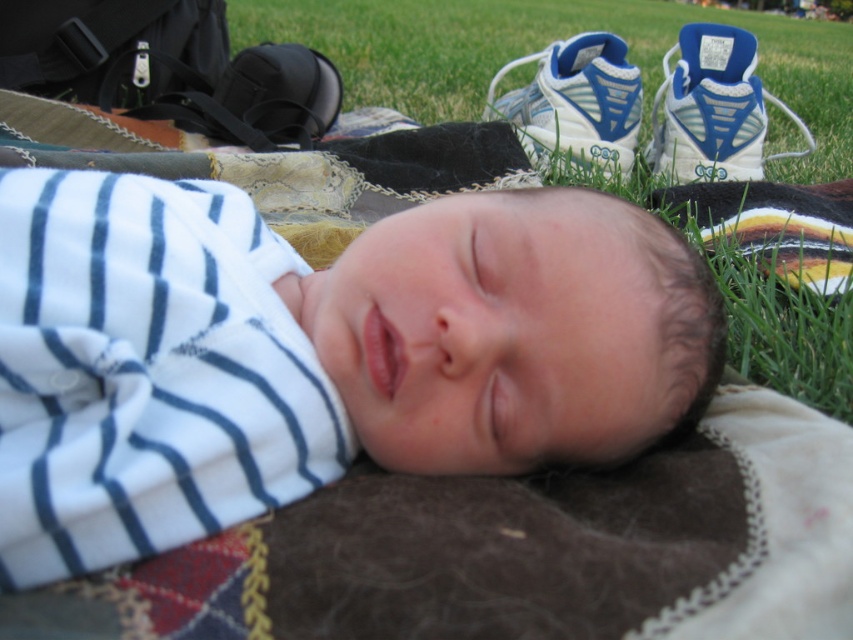
Question: Which of the following is the farthest from the observer?

Choices:
 (A) coord(612,102)
 (B) coord(51,502)
 (C) coord(790,305)
 (D) coord(680,65)

Answer: (D)

Question: In this image, where is white synthetic running shoe at upper right located relative to white mesh running shoe at upper center?

Choices:
 (A) right
 (B) left

Answer: (A)

Question: Considering the relative positions of white soft fabric newborn at center and green grass at center in the image provided, where is white soft fabric newborn at center located with respect to green grass at center?

Choices:
 (A) below
 (B) above

Answer: (A)

Question: Which of the following is the closest to the observer?

Choices:
 (A) (183, 461)
 (B) (699, 24)

Answer: (A)

Question: Which point appears farthest from the camera in this image?

Choices:
 (A) (463, 321)
 (B) (692, 132)
 (C) (816, 65)
 (D) (521, 88)

Answer: (C)

Question: Is white synthetic running shoe at upper right positioned at the back of white mesh running shoe at upper center?

Choices:
 (A) no
 (B) yes

Answer: (B)